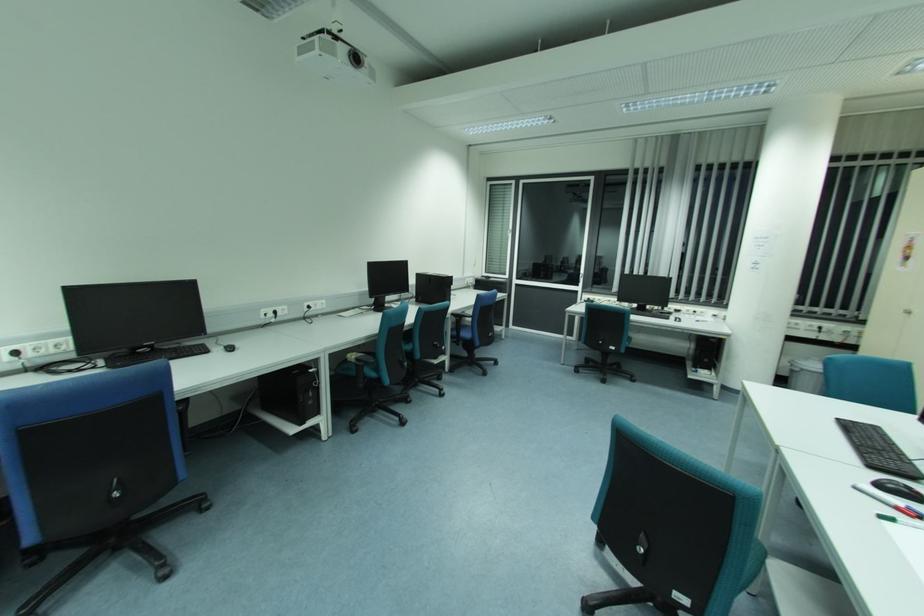
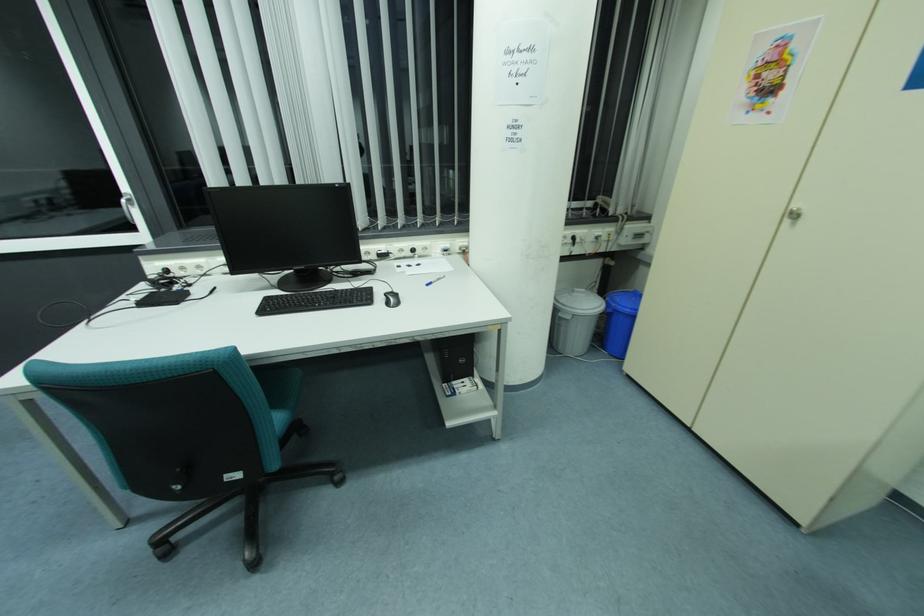
Locate, in the second image, the point that corresponds to point 796,370 in the first image.

(568, 318)